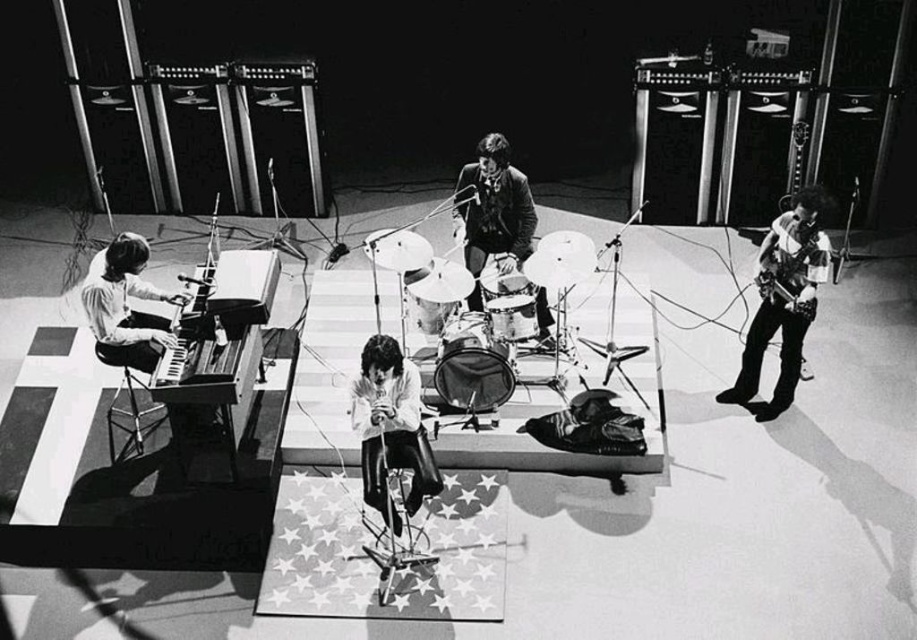
Does white leather jacket at center appear on the left side of shiny silver guitar at right?

Correct, you'll find white leather jacket at center to the left of shiny silver guitar at right.

Locate an element on the screen. This screenshot has width=917, height=640. white leather jacket at center is located at coordinates (390, 428).

Can you confirm if shiny black guitar at right is shorter than smooth black piano at left?

No, shiny black guitar at right is not shorter than smooth black piano at left.

Does point (802, 227) come farther from viewer compared to point (186, 301)?

No, it is in front of (186, 301).

Does point (725, 401) come closer to viewer compared to point (120, 346)?

No.

This screenshot has height=640, width=917. I want to click on shiny black guitar at right, so click(x=783, y=300).

What do you see at coordinates (390, 428) in the screenshot? Image resolution: width=917 pixels, height=640 pixels. I see `white leather jacket at center` at bounding box center [390, 428].

This screenshot has height=640, width=917. I want to click on white leather jacket at center, so click(390, 428).